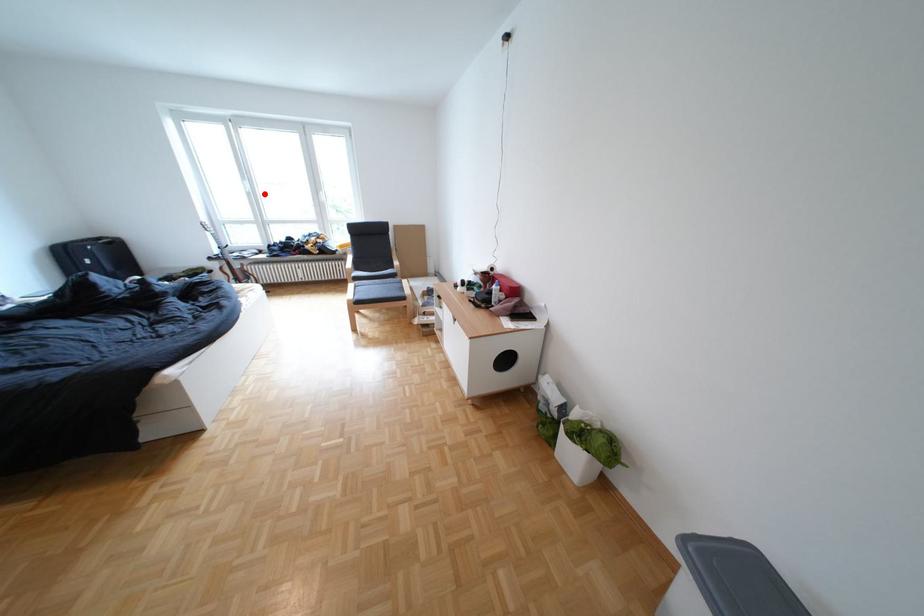
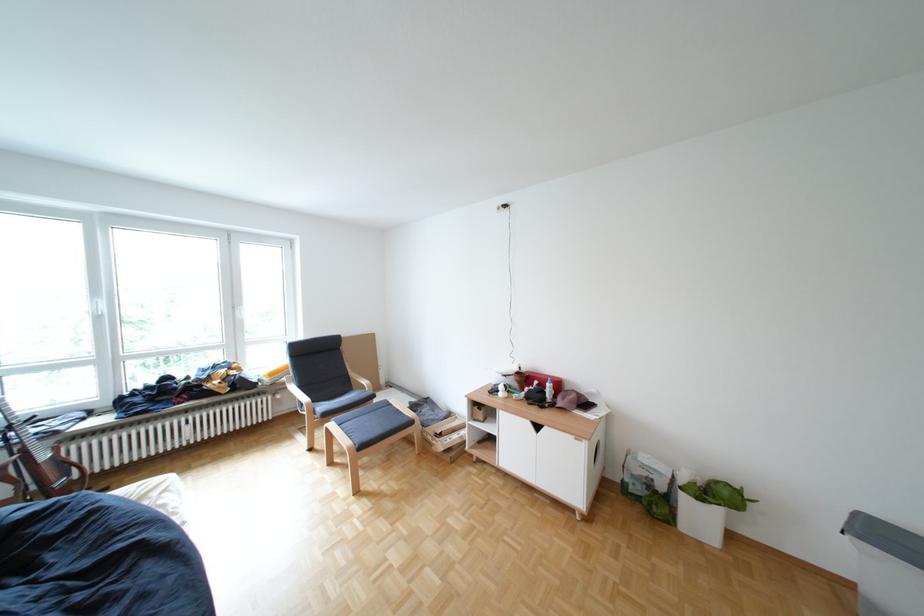
Question: I am providing you with two images of the same scene from different viewpoints. A red point is shown in image1. For the corresponding object point in image2, is it positioned nearer or farther from the camera?

Choices:
 (A) Nearer
 (B) Farther

Answer: (B)